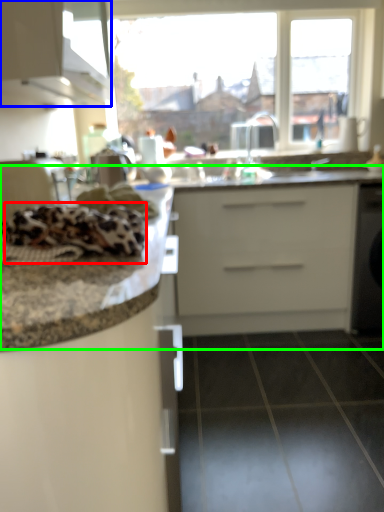
Question: Which object is positioned closest to material (highlighted by a red box)? Select from cabinetry (highlighted by a blue box) and counter top (highlighted by a green box).

Choices:
 (A) cabinetry
 (B) counter top

Answer: (A)